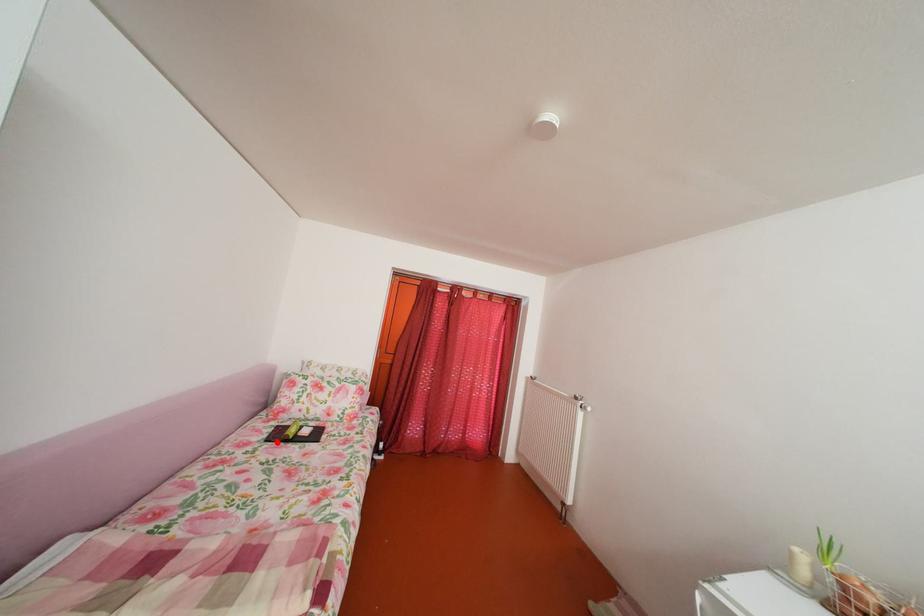
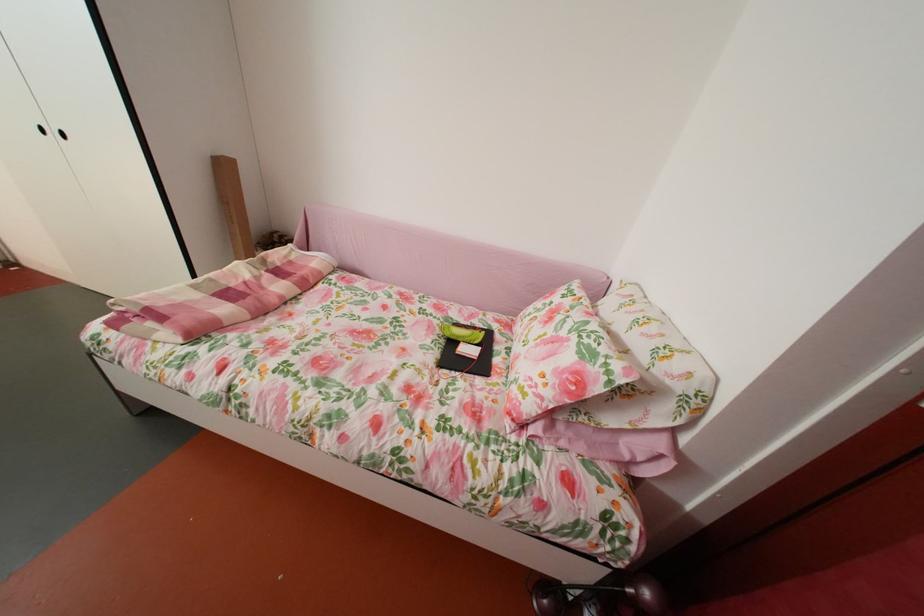
Locate, in the second image, the point that corresponds to the highlighted location in the first image.

(473, 328)